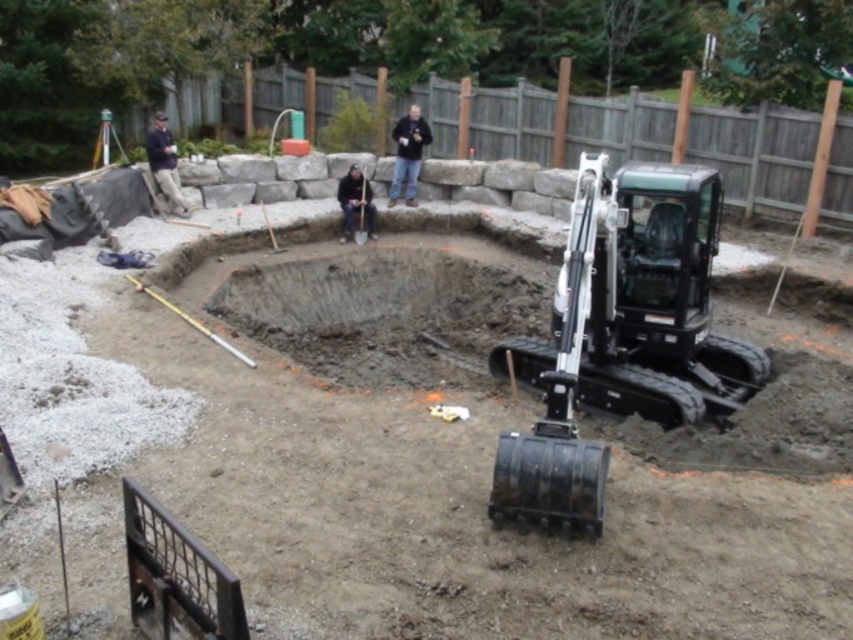
You are a construction worker who needs to choose between the black rubber excavator at lower right and the black plastic shovel at center for digging a deep hole. Which tool would be more efficient and why?

The black rubber excavator at lower right is more efficient because it has a larger size compared to the black plastic shovel at center, making it better suited for digging deep holes.

You are a construction worker who needs to choose between two pieces of fabric for covering equipment. You see the dark blue shirt at upper left and the black fabric at center. Which one is wider?

The black fabric at center is wider than the dark blue shirt at upper left.